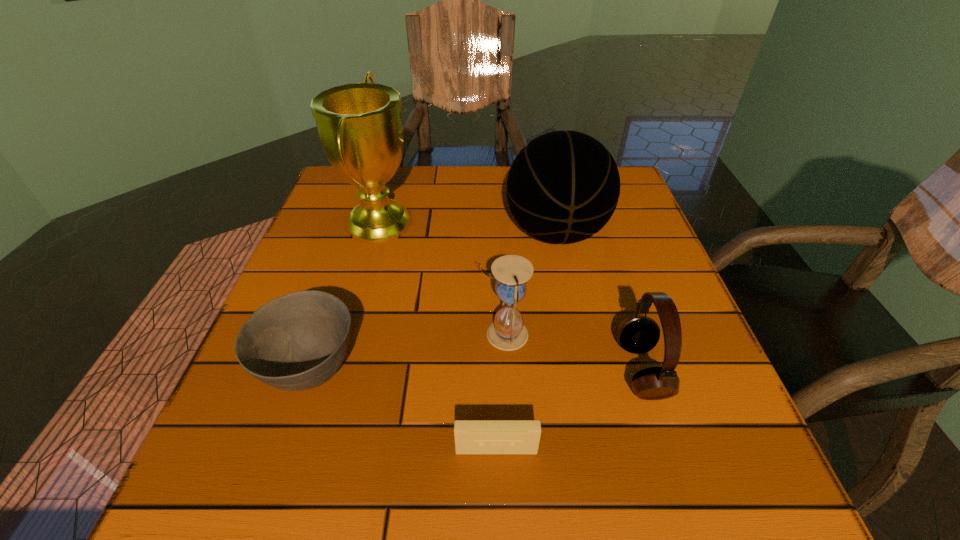
Locate an element on the screen. free spot that satisfies the following two spatial constraints: 1. on the shiny surface of the tallest object; 2. on the back side of the hourglass is located at coordinates (348, 334).

Where is `vacant space that satisfies the following two spatial constraints: 1. on the back side of the hourglass; 2. on the left side of the fifth shortest object`? This screenshot has width=960, height=540. vacant space that satisfies the following two spatial constraints: 1. on the back side of the hourglass; 2. on the left side of the fifth shortest object is located at coordinates (498, 233).

Where is `vacant region that satisfies the following two spatial constraints: 1. on the ear pads of the third shortest object; 2. at the front of the nearest object with spools`? Image resolution: width=960 pixels, height=540 pixels. vacant region that satisfies the following two spatial constraints: 1. on the ear pads of the third shortest object; 2. at the front of the nearest object with spools is located at coordinates (667, 450).

Where is `blank area in the image that satisfies the following two spatial constraints: 1. on the shiny surface of the tallest object; 2. on the right side of the basketball`? blank area in the image that satisfies the following two spatial constraints: 1. on the shiny surface of the tallest object; 2. on the right side of the basketball is located at coordinates (376, 233).